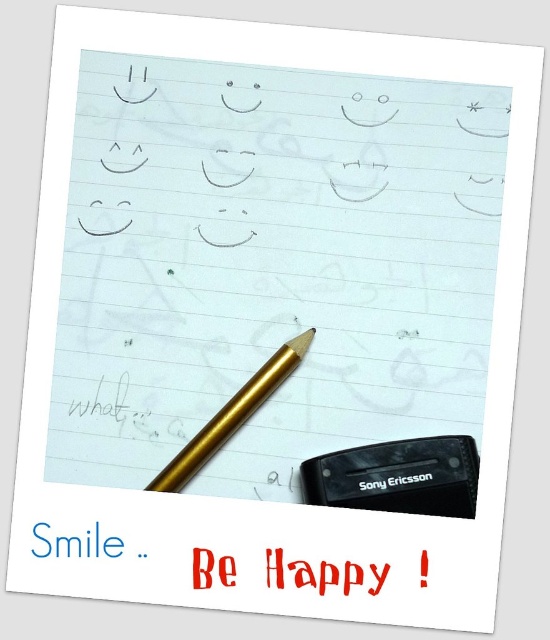
You are organizing your desk and need to place the black plastic eraser at bottom right and the red plastic text at center. Based on the scene, which object is closer to the right edge of the desk?

The black plastic eraser at bottom right is closer to the right edge of the desk because it is positioned to the right of the red plastic text at center.

Looking at this image, you are trying to locate the gold metallic pencil at center on the notebook paper. What are the coordinates of its position?

The gold metallic pencil at center is located at coordinates point (232, 416).